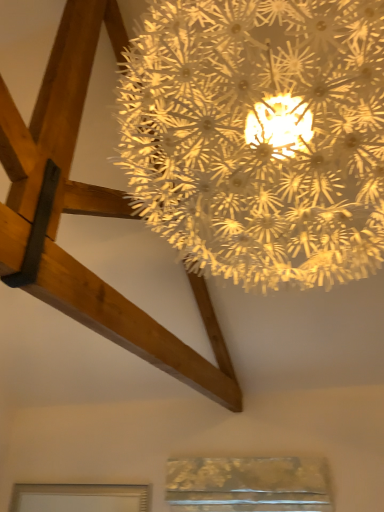
Describe the element at coordinates (248, 484) in the screenshot. I see `metallic gold window at lower center, acting as the second window starting from the left` at that location.

This screenshot has width=384, height=512. I want to click on matte silver frame at lower left, the first window in the left-to-right sequence, so click(x=80, y=498).

Which is in front, point (179, 486) or point (193, 162)?

The point (193, 162) is in front.

Is metallic gold window at lower center, placed as the 1th window when sorted from right to left, smaller than illuminated paper-like at upper center?

Indeed, metallic gold window at lower center, placed as the 1th window when sorted from right to left, has a smaller size compared to illuminated paper-like at upper center.

From the image's perspective, which is above, metallic gold window at lower center, placed as the 1th window when sorted from right to left, or illuminated paper-like at upper center?

illuminated paper-like at upper center appears higher in the image.

Between illuminated paper-like at upper center and matte silver frame at lower left, acting as the 2th window starting from the right, which one has less height?

matte silver frame at lower left, acting as the 2th window starting from the right, is shorter.

Which is more to the left, illuminated paper-like at upper center or matte silver frame at lower left, acting as the 2th window starting from the right?

matte silver frame at lower left, acting as the 2th window starting from the right.

Considering their positions, is illuminated paper-like at upper center located in front of or behind matte silver frame at lower left, the first window in the left-to-right sequence?

Visually, illuminated paper-like at upper center is located in front of matte silver frame at lower left, the first window in the left-to-right sequence.

The image size is (384, 512). I want to click on lamp that appears in front of the matte silver frame at lower left, acting as the 2th window starting from the right, so click(x=259, y=136).

Considering the relative sizes of matte silver frame at lower left, acting as the 2th window starting from the right, and illuminated paper-like at upper center in the image provided, is matte silver frame at lower left, acting as the 2th window starting from the right, bigger than illuminated paper-like at upper center?

No.

From the image's perspective, is matte silver frame at lower left, the first window in the left-to-right sequence, located beneath illuminated paper-like at upper center?

Yes, from the image's perspective, matte silver frame at lower left, the first window in the left-to-right sequence, is below illuminated paper-like at upper center.

Considering the positions of points (75, 488) and (202, 46), is point (75, 488) closer to camera compared to point (202, 46)?

No, (75, 488) is behind (202, 46).

Where is `window below the metallic gold window at lower center, acting as the second window starting from the left (from the image's perspective)`? The height and width of the screenshot is (512, 384). window below the metallic gold window at lower center, acting as the second window starting from the left (from the image's perspective) is located at coordinates (80, 498).

Is metallic gold window at lower center, acting as the second window starting from the left, bigger or smaller than matte silver frame at lower left, the first window in the left-to-right sequence?

Considering their sizes, metallic gold window at lower center, acting as the second window starting from the left, takes up more space than matte silver frame at lower left, the first window in the left-to-right sequence.

Is point (168, 487) positioned in front of point (56, 511)?

Yes, it is.

How distant is metallic gold window at lower center, placed as the 1th window when sorted from right to left, from matte silver frame at lower left, the first window in the left-to-right sequence?

A distance of 32.31 inches exists between metallic gold window at lower center, placed as the 1th window when sorted from right to left, and matte silver frame at lower left, the first window in the left-to-right sequence.

Are matte silver frame at lower left, the first window in the left-to-right sequence, and metallic gold window at lower center, acting as the second window starting from the left, located far from each other?

No, matte silver frame at lower left, the first window in the left-to-right sequence, is not far from metallic gold window at lower center, acting as the second window starting from the left.

How many degrees apart are the facing directions of matte silver frame at lower left, acting as the 2th window starting from the right, and metallic gold window at lower center, placed as the 1th window when sorted from right to left?

0.00236 degrees.

Is matte silver frame at lower left, acting as the 2th window starting from the right, inside or outside of metallic gold window at lower center, acting as the second window starting from the left?

matte silver frame at lower left, acting as the 2th window starting from the right, is not inside metallic gold window at lower center, acting as the second window starting from the left, it's outside.

From the image's perspective, between matte silver frame at lower left, acting as the 2th window starting from the right, and metallic gold window at lower center, acting as the second window starting from the left, which one is located above?

metallic gold window at lower center, acting as the second window starting from the left, appears higher in the image.

Does illuminated paper-like at upper center have a lesser height compared to metallic gold window at lower center, placed as the 1th window when sorted from right to left?

No, illuminated paper-like at upper center is not shorter than metallic gold window at lower center, placed as the 1th window when sorted from right to left.

From the image's perspective, is illuminated paper-like at upper center located above or below metallic gold window at lower center, placed as the 1th window when sorted from right to left?

Based on their image positions, illuminated paper-like at upper center is located above metallic gold window at lower center, placed as the 1th window when sorted from right to left.

Is point (340, 218) farther from camera compared to point (242, 490)?

No.

Is illuminated paper-like at upper center wider than metallic gold window at lower center, acting as the second window starting from the left?

Yes, illuminated paper-like at upper center is wider than metallic gold window at lower center, acting as the second window starting from the left.

From a real-world perspective, starting from the illuminated paper-like at upper center, which window is the 1st one below it? Please provide its 2D coordinates.

[(248, 484)]

From the image's perspective, starting from the illuminated paper-like at upper center, which window is the 2nd one below? Please provide its 2D coordinates.

[(80, 498)]

When comparing their distances from metallic gold window at lower center, acting as the second window starting from the left, does matte silver frame at lower left, acting as the 2th window starting from the right, or illuminated paper-like at upper center seem further?

illuminated paper-like at upper center.

Looking at the image, which one is located closer to illuminated paper-like at upper center, matte silver frame at lower left, the first window in the left-to-right sequence, or metallic gold window at lower center, placed as the 1th window when sorted from right to left?

Based on the image, metallic gold window at lower center, placed as the 1th window when sorted from right to left, appears to be nearer to illuminated paper-like at upper center.

From the image, which object appears to be farther from metallic gold window at lower center, acting as the second window starting from the left, illuminated paper-like at upper center or matte silver frame at lower left, acting as the 2th window starting from the right?

Based on the image, illuminated paper-like at upper center appears to be further to metallic gold window at lower center, acting as the second window starting from the left.

From the image, which object appears to be nearer to matte silver frame at lower left, acting as the 2th window starting from the right, illuminated paper-like at upper center or metallic gold window at lower center, placed as the 1th window when sorted from right to left?

The object closer to matte silver frame at lower left, acting as the 2th window starting from the right, is metallic gold window at lower center, placed as the 1th window when sorted from right to left.

Looking at the image, which one is located further to illuminated paper-like at upper center, metallic gold window at lower center, placed as the 1th window when sorted from right to left, or matte silver frame at lower left, the first window in the left-to-right sequence?

matte silver frame at lower left, the first window in the left-to-right sequence.

Considering their positions, is metallic gold window at lower center, placed as the 1th window when sorted from right to left, positioned closer to matte silver frame at lower left, acting as the 2th window starting from the right, than illuminated paper-like at upper center?

Among the two, metallic gold window at lower center, placed as the 1th window when sorted from right to left, is located nearer to matte silver frame at lower left, acting as the 2th window starting from the right.

Locate an element on the screen. The image size is (384, 512). window between illuminated paper-like at upper center and matte silver frame at lower left, the first window in the left-to-right sequence, in the up-down direction is located at coordinates (248, 484).